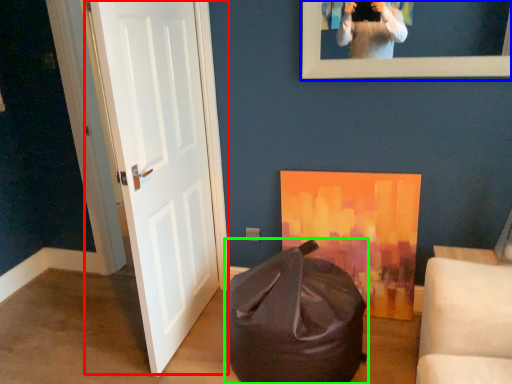
Question: Which object is positioned farthest from door (highlighted by a red box)? Select from picture frame (highlighted by a blue box) and bean bag chair (highlighted by a green box).

Choices:
 (A) picture frame
 (B) bean bag chair

Answer: (A)